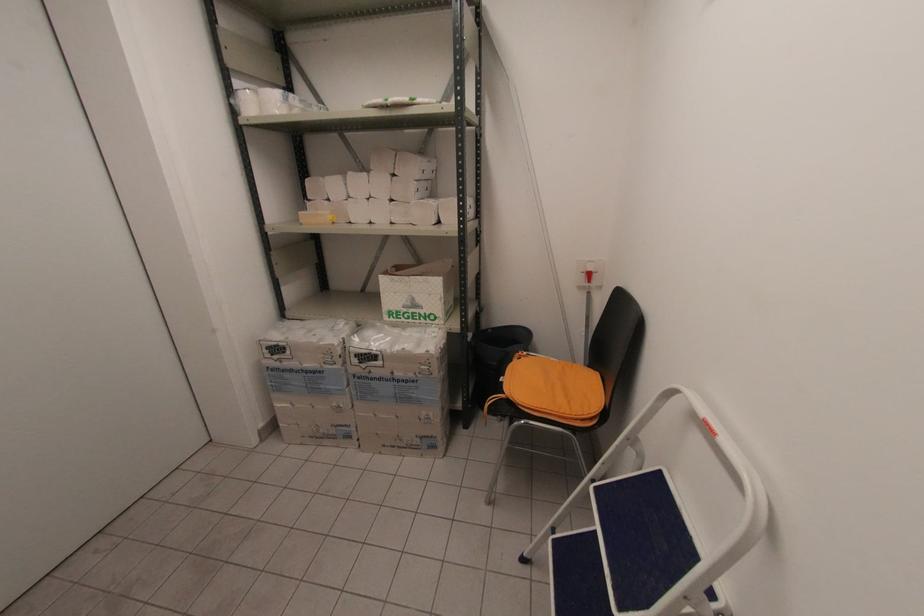
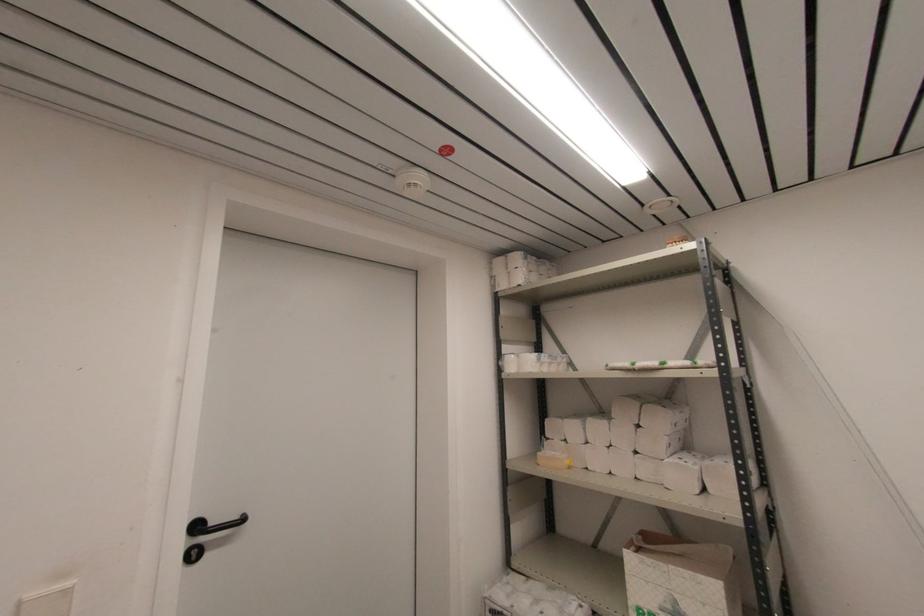
Locate, in the second image, the point that corresponds to point 327,179 in the first image.

(566, 421)